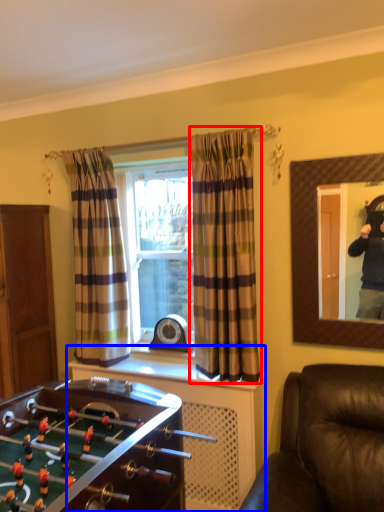
Question: Which object appears farthest to the camera in this image, curtain (highlighted by a red box) or dresser (highlighted by a blue box)?

Choices:
 (A) curtain
 (B) dresser

Answer: (A)